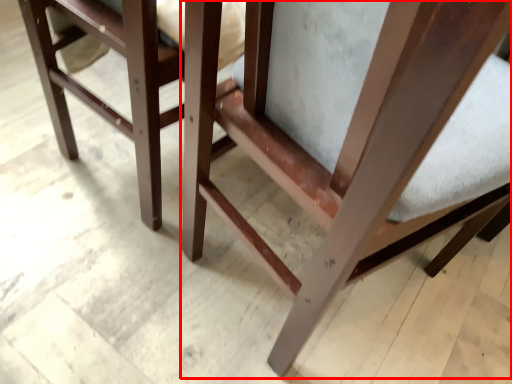
Question: Where is chair (annotated by the red box) located in relation to furniture in the image?

Choices:
 (A) right
 (B) left

Answer: (A)